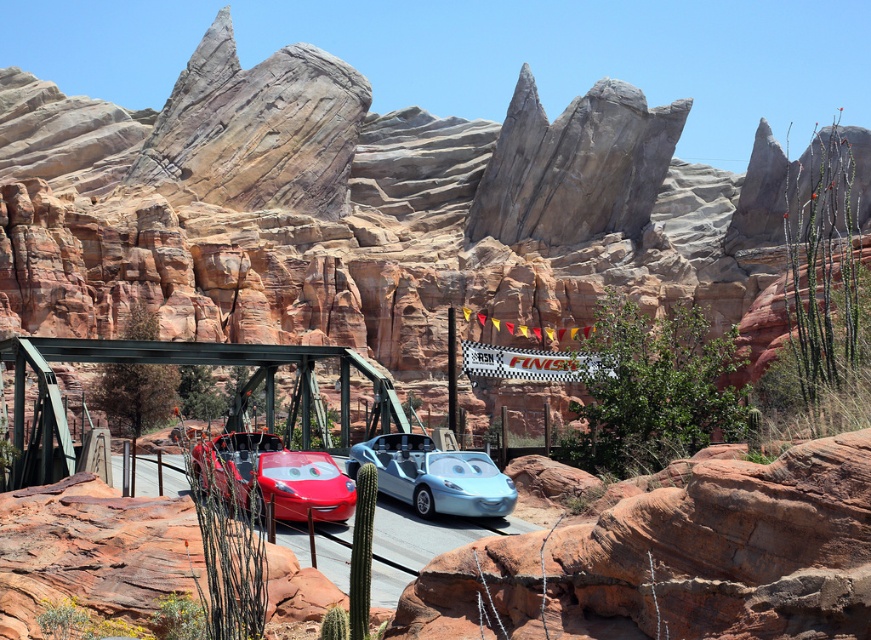
Question: Which point appears closest to the camera in this image?

Choices:
 (A) coord(468,484)
 (B) coord(402,413)
 (C) coord(223,481)

Answer: (C)

Question: Is metallic steel bridge at center wider than shiny metallic car at center?

Choices:
 (A) no
 (B) yes

Answer: (B)

Question: Among these objects, which one is farthest from the camera?

Choices:
 (A) metallic steel bridge at center
 (B) glossy red car at center

Answer: (A)

Question: Based on their relative distances, which object is farther from the metallic steel bridge at center?

Choices:
 (A) glossy red car at center
 (B) shiny metallic car at center

Answer: (A)

Question: Is metallic steel bridge at center bigger than glossy red car at center?

Choices:
 (A) yes
 (B) no

Answer: (A)

Question: Can you confirm if metallic steel bridge at center is positioned below shiny metallic car at center?

Choices:
 (A) no
 (B) yes

Answer: (A)